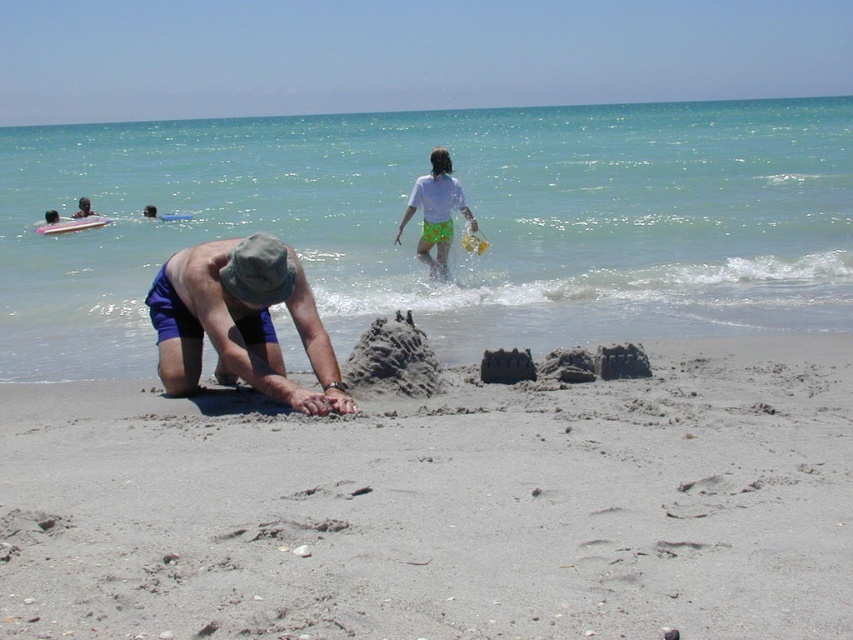
Question: Which object is closer to the camera taking this photo?

Choices:
 (A) white cotton shirt at upper center
 (B) smooth blue shorts at lower left
 (C) smooth skin person at upper left

Answer: (A)

Question: Among these objects, which one is farthest from the camera?

Choices:
 (A) smooth skin person at upper left
 (B) brown fabric hat at center
 (C) smooth blue shorts at lower left

Answer: (A)

Question: Is smooth blue shorts at lower left closer to camera compared to smooth skin person at upper left?

Choices:
 (A) no
 (B) yes

Answer: (B)

Question: Is brown fabric hat at center above white cotton shirt at upper center?

Choices:
 (A) yes
 (B) no

Answer: (B)

Question: Among these points, which one is farthest from the camera?

Choices:
 (A) (183, 627)
 (B) (78, 208)
 (C) (154, 208)
 (D) (461, 188)

Answer: (B)

Question: Is gray sandcastle at center bigger than smooth blue shorts at lower left?

Choices:
 (A) no
 (B) yes

Answer: (B)